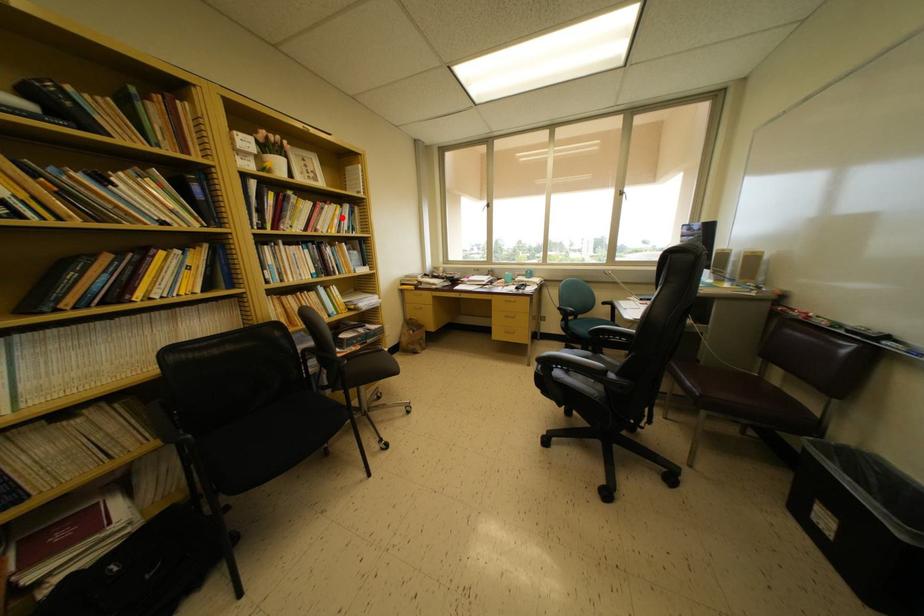
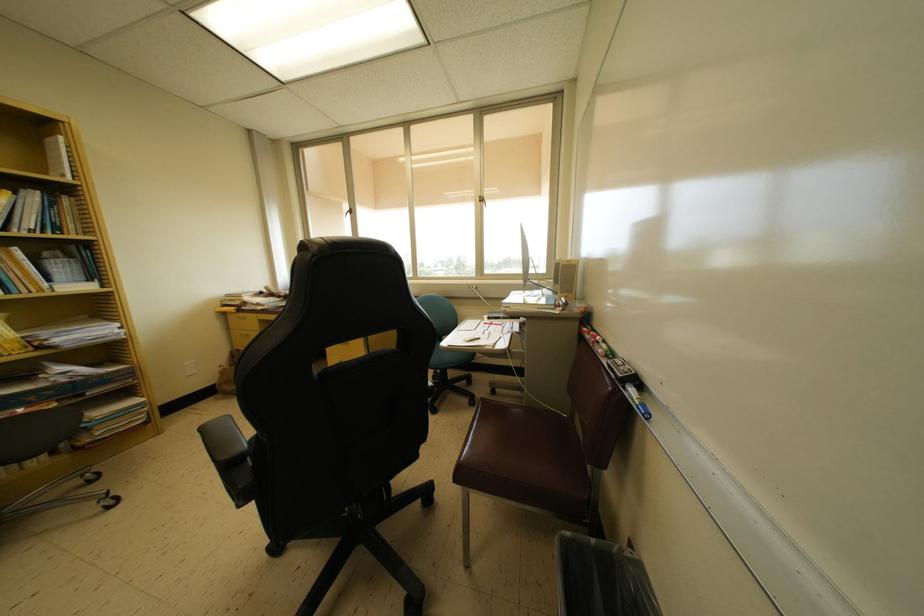
Question: I am providing you with two images of the same scene from different viewpoints. In image1, a red point is highlighted. Considering the same 3D point in image2, which of the following is correct?

Choices:
 (A) It is closer
 (B) It is farther

Answer: (B)